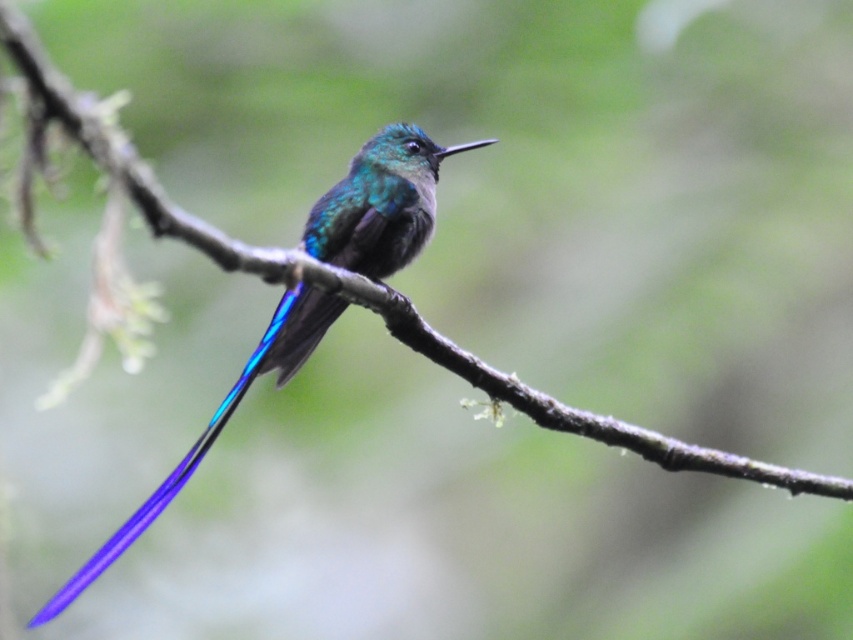
Who is shorter, metallic iridescent hummingbird at center or glossy blue tail at center?

Standing shorter between the two is glossy blue tail at center.

Is metallic iridescent hummingbird at center to the right of glossy blue tail at center from the viewer's perspective?

Indeed, metallic iridescent hummingbird at center is positioned on the right side of glossy blue tail at center.

Describe the element at coordinates (380, 204) in the screenshot. This screenshot has width=853, height=640. I see `metallic iridescent hummingbird at center` at that location.

You are a GUI agent. You are given a task and a screenshot of the screen. Output one action in this format:
    pyautogui.click(x=<x>, y=<y>)
    Task: Click on the metallic iridescent hummingbird at center
    This screenshot has height=640, width=853.
    Given the screenshot: What is the action you would take?
    pyautogui.click(x=380, y=204)